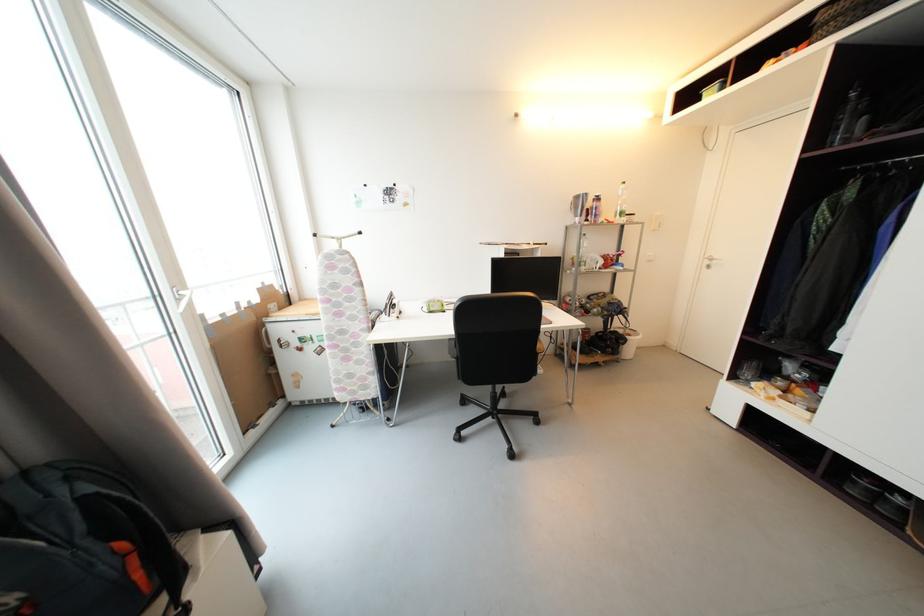
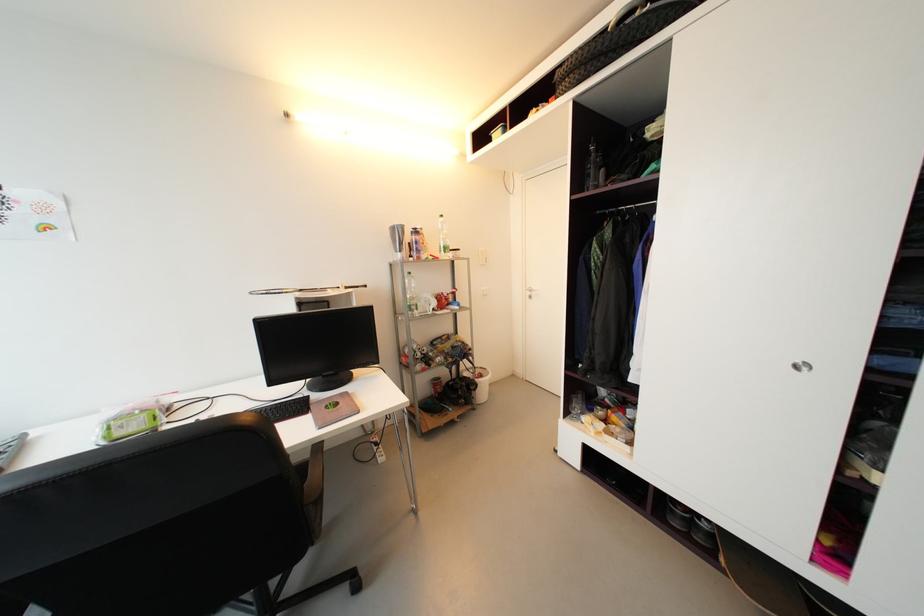
Find the pixel in the second image that matches (711,264) in the first image.

(533, 294)